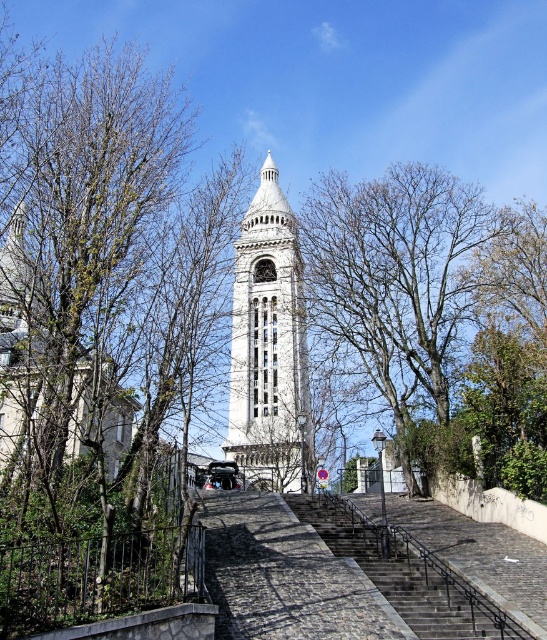
Question: Based on their relative distances, which object is farther from the bare branches at center?

Choices:
 (A) green leafy tree at upper left
 (B) dark gray stone stairs at center
 (C) white stone clock tower at center

Answer: (B)

Question: Can you confirm if bare branches at center is bigger than white stone clock tower at center?

Choices:
 (A) yes
 (B) no

Answer: (A)

Question: Can you confirm if green leafy tree at upper left is wider than dark gray stone stairs at center?

Choices:
 (A) no
 (B) yes

Answer: (B)

Question: Is green leafy tree at upper left to the right of white stone clock tower at center from the viewer's perspective?

Choices:
 (A) no
 (B) yes

Answer: (A)

Question: Which point is farther from the camera taking this photo?

Choices:
 (A) pos(101,150)
 (B) pos(264,180)
 (C) pos(394,408)
 (D) pos(416,618)

Answer: (B)

Question: Which object is the farthest from the dark gray stone stairs at center?

Choices:
 (A) bare branches at center
 (B) white stone clock tower at center

Answer: (A)